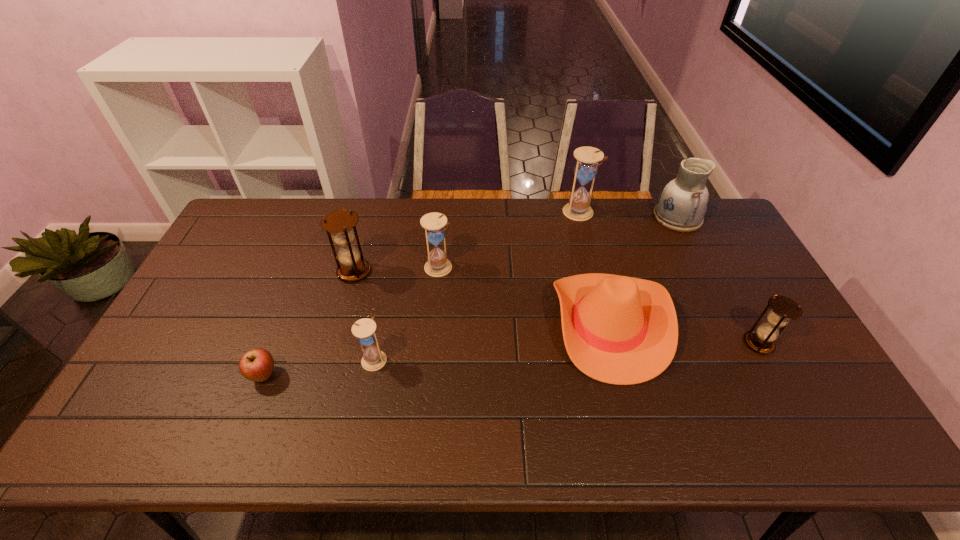
You are a GUI agent. You are given a task and a screenshot of the screen. Output one action in this format:
    pyautogui.click(x=<x>, y=<y>)
    Task: Click on the vacant space situated 0.310m on the left of the nearest white hourglass
    
    Given the screenshot: What is the action you would take?
    pyautogui.click(x=246, y=359)

You are a GUI agent. You are given a task and a screenshot of the screen. Output one action in this format:
    pyautogui.click(x=<x>, y=<y>)
    Task: Click on the vacant space located on the back of the shortest object
    
    Given the screenshot: What is the action you would take?
    pyautogui.click(x=297, y=290)

Where is `hourglass located in the far edge section of the desktop`? This screenshot has width=960, height=540. hourglass located in the far edge section of the desktop is located at coordinates (585, 170).

This screenshot has height=540, width=960. Find the location of `pottery located in the far edge section of the desktop`. pottery located in the far edge section of the desktop is located at coordinates (681, 206).

What are the coordinates of `pottery at the right edge` in the screenshot? It's located at (681, 206).

Identify the location of hourglass at the right edge. Image resolution: width=960 pixels, height=540 pixels. (783, 309).

Where is `object at the far right corner`? object at the far right corner is located at coordinates (681, 206).

At what (x,y) coordinates should I click in order to perform the action: click on free space at the far edge of the desktop. Please return your answer as a coordinate pair (x, y). This screenshot has width=960, height=540. Looking at the image, I should click on (658, 226).

I want to click on free location at the near edge, so click(x=346, y=442).

The height and width of the screenshot is (540, 960). Identify the location of free spot at the left edge of the desktop. tap(205, 293).